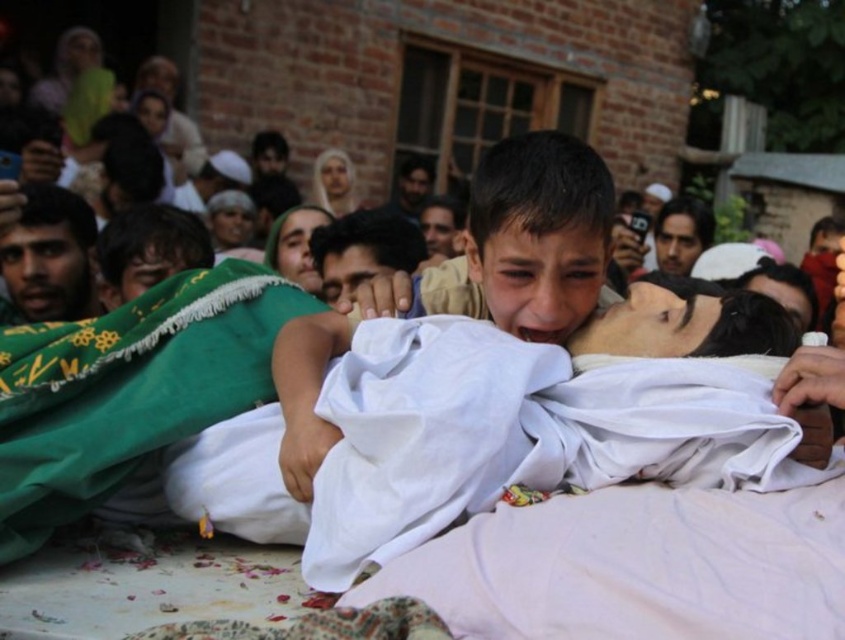
Is smooth white cloth at center shorter than dark brown hair at center?

No.

Can you confirm if smooth white cloth at center is positioned to the right of dark brown hair at center?

Indeed, smooth white cloth at center is positioned on the right side of dark brown hair at center.

Between point (477, 300) and point (433, 179), which one is positioned behind?

Positioned behind is point (433, 179).

Identify the location of smooth white cloth at center. (472, 276).

Can you confirm if smooth skin face at upper center is thinner than dark brown hair at center?

Incorrect, smooth skin face at upper center's width is not less than dark brown hair at center's.

Between smooth skin face at upper center and dark brown hair at center, which one is positioned lower?

smooth skin face at upper center

What do you see at coordinates (680, 234) in the screenshot?
I see `smooth skin face at upper center` at bounding box center [680, 234].

Identify the location of smooth skin face at upper center. (680, 234).

Who is positioned more to the left, dark brown skin at left or dark green fabric at left?

Positioned to the left is dark brown skin at left.

Consider the image. Who is lower down, dark brown skin at left or dark green fabric at left?

dark green fabric at left

Locate an element on the screen. This screenshot has height=640, width=845. dark brown skin at left is located at coordinates (50, 257).